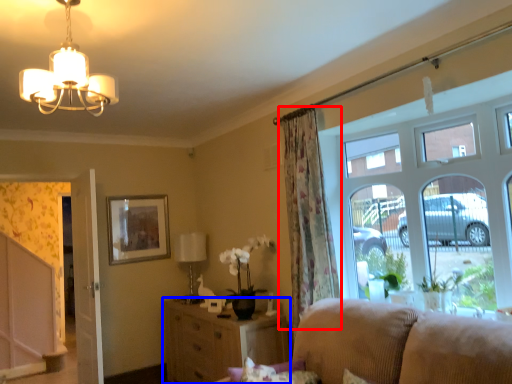
Question: Which point is further to the camera, curtain (highlighted by a red box) or cabinetry (highlighted by a blue box)?

Choices:
 (A) curtain
 (B) cabinetry

Answer: (B)